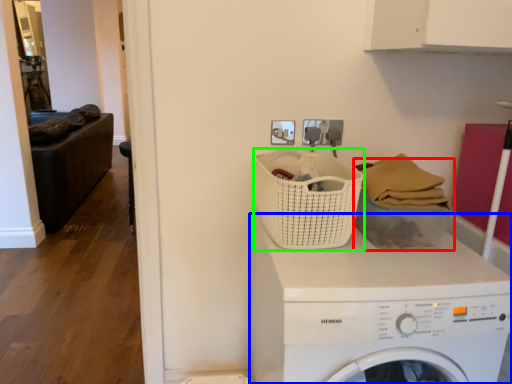
Question: Considering the real-world distances, which object is farthest from basket (highlighted by a red box)? washing machine (highlighted by a blue box) or basket (highlighted by a green box)?

Choices:
 (A) washing machine
 (B) basket

Answer: (A)